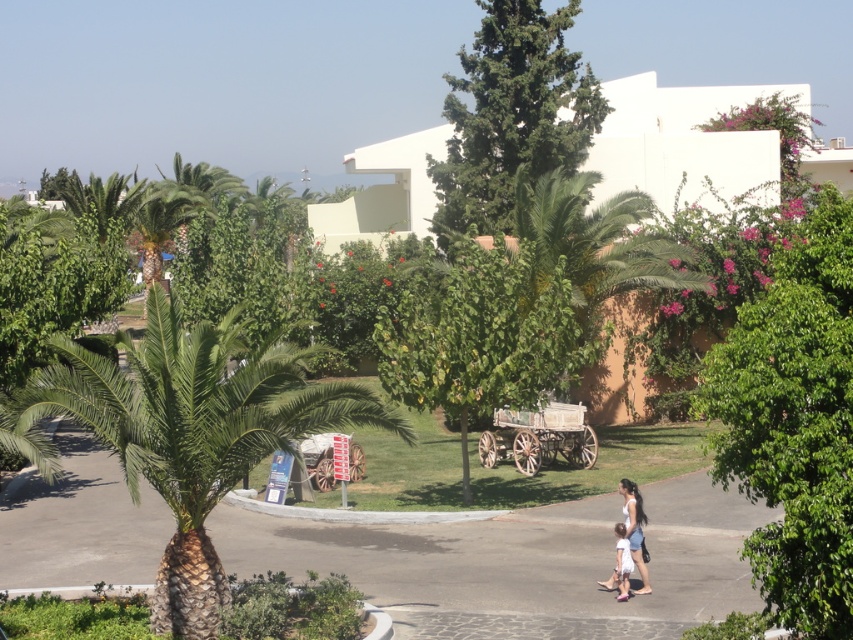
Is point (645, 588) behind point (621, 563)?

Yes, point (645, 588) is behind point (621, 563).

How much distance is there between white cotton dress at lower right and light blue denim dress at lower center?

white cotton dress at lower right is 9.72 inches from light blue denim dress at lower center.

Is point (643, 572) farther from viewer compared to point (614, 563)?

No, it is not.

You are a GUI agent. You are given a task and a screenshot of the screen. Output one action in this format:
    pyautogui.click(x=<x>, y=<y>)
    Task: Click on the white cotton dress at lower right
    The image size is (853, 640).
    Given the screenshot: What is the action you would take?
    tap(634, 528)

Which of these two, green leafy tree at center or green leafy tree at upper center, stands shorter?

green leafy tree at center is shorter.

Does point (415, 316) come behind point (514, 74)?

No.

I want to click on green leafy tree at center, so click(479, 337).

Does green leafy tree at right appear on the left side of light blue denim dress at lower center?

No, green leafy tree at right is not to the left of light blue denim dress at lower center.

I want to click on green leafy tree at right, so click(792, 426).

Based on the photo, who is more forward, [807,490] or [624,573]?

Positioned in front is point [807,490].

Identify the location of green leafy tree at right. Image resolution: width=853 pixels, height=640 pixels. (792, 426).